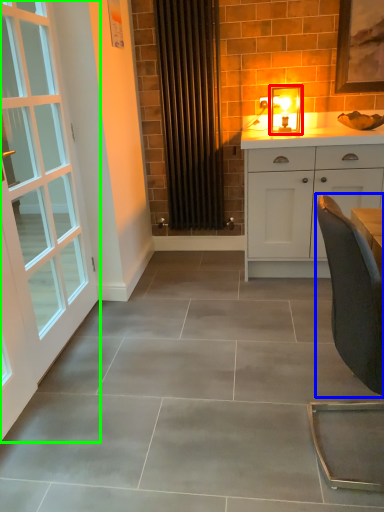
Question: Which object is the farthest from light fixture (highlighted by a red box)? Choose among these: chair (highlighted by a blue box) or door (highlighted by a green box).

Choices:
 (A) chair
 (B) door

Answer: (A)